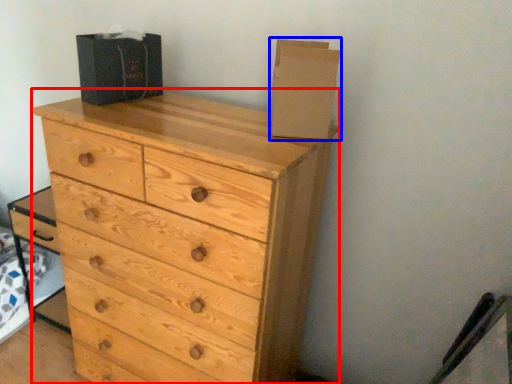
Question: Which point is closer to the camera, chest of drawers (highlighted by a red box) or cardboard box (highlighted by a blue box)?

Choices:
 (A) chest of drawers
 (B) cardboard box

Answer: (A)